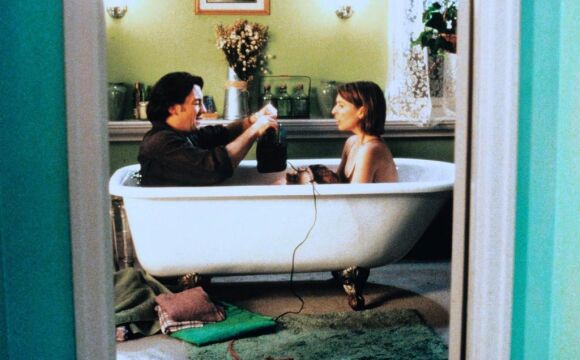
You are a GUI agent. You are given a task and a screenshot of the screen. Output one action in this format:
    pyautogui.click(x=<x>, y=<y>)
    Task: Click on the door frame
    
    Given the screenshot: What is the action you would take?
    pyautogui.click(x=97, y=260), pyautogui.click(x=490, y=170)